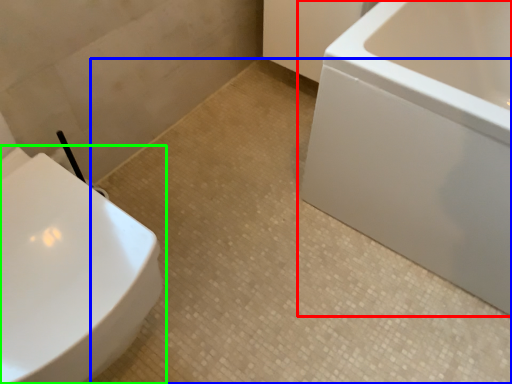
Question: Which object is positioned farthest from bathtub (highlighted by a red box)? Select from ceramic tile (highlighted by a blue box) and toilet (highlighted by a green box).

Choices:
 (A) ceramic tile
 (B) toilet

Answer: (B)